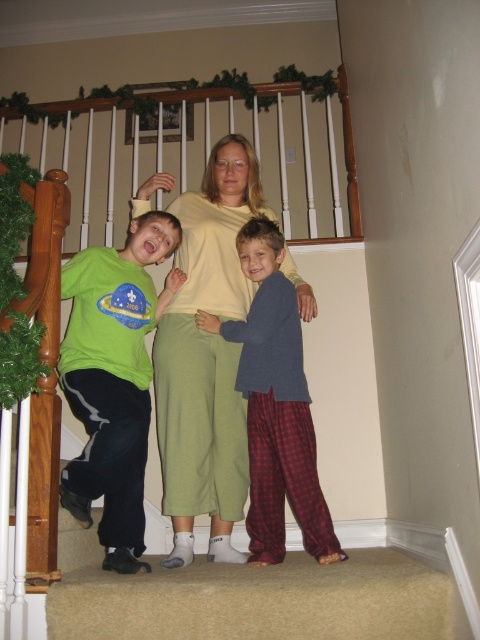
You are a photographer setting up for a family photo. You notice the matte green shirt at left and the blue fleece sweater at center in the scene. Which clothing item is positioned higher up in the image?

The matte green shirt at left is above the blue fleece sweater at center, so the matte green shirt at left is positioned higher up in the image.

You are helping to organize a clothing donation drive. You have a donation box that can only fit items smaller than the light yellow knit sweater at center. Can the matte green shirt at left be placed into the box?

The light yellow knit sweater at center is bigger than the matte green shirt at left. Since the donation box can only fit items smaller than the light yellow knit sweater at center, the matte green shirt at left can be placed into the box because it is smaller.